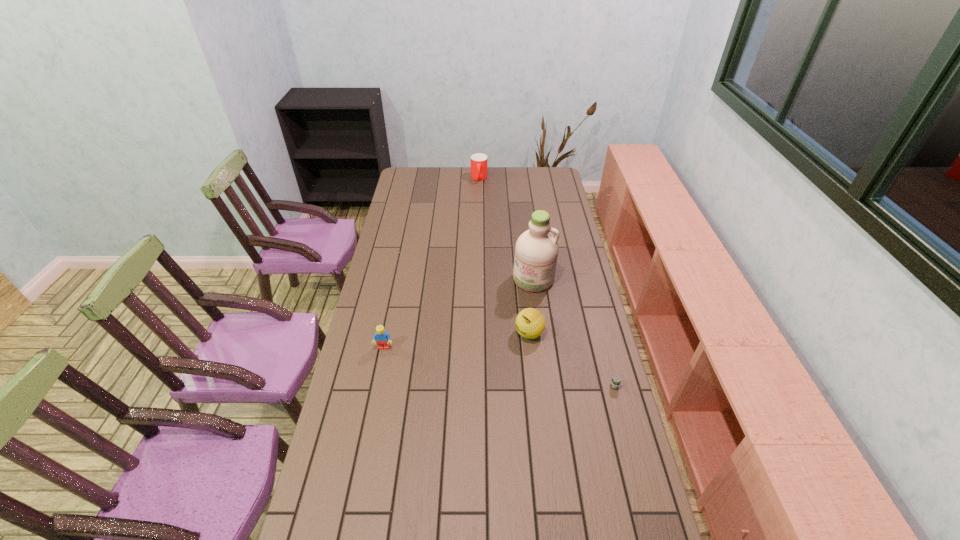
The height and width of the screenshot is (540, 960). I want to click on object located in the left edge section of the desktop, so click(x=382, y=338).

At what (x,y) coordinates should I click in order to perform the action: click on beer can situated at the right edge. Please return your answer as a coordinate pair (x, y). This screenshot has height=540, width=960. Looking at the image, I should click on [616, 380].

The height and width of the screenshot is (540, 960). Find the location of `cleansing agent present at the right edge`. cleansing agent present at the right edge is located at coordinates (536, 251).

In the image, there is a desktop. At what (x,y) coordinates should I click in order to perform the action: click on free space at the far edge. Please return your answer as a coordinate pair (x, y). This screenshot has height=540, width=960. Looking at the image, I should click on (437, 169).

In the image, there is a desktop. Identify the location of free space at the near edge. This screenshot has width=960, height=540. (490, 510).

Where is `free spot at the left edge of the desktop`? The width and height of the screenshot is (960, 540). free spot at the left edge of the desktop is located at coordinates (319, 484).

In the image, there is a desktop. Identify the location of free region at the right edge. This screenshot has height=540, width=960. (582, 361).

Locate an element on the screen. free space at the near left corner of the desktop is located at coordinates (359, 509).

Find the location of `vacant space that is in between the shortest object and the softball`. vacant space that is in between the shortest object and the softball is located at coordinates (572, 360).

At what (x,y) coordinates should I click in order to perform the action: click on vacant space that is in between the cleansing agent and the softball. Please return your answer as a coordinate pair (x, y). The height and width of the screenshot is (540, 960). Looking at the image, I should click on (532, 306).